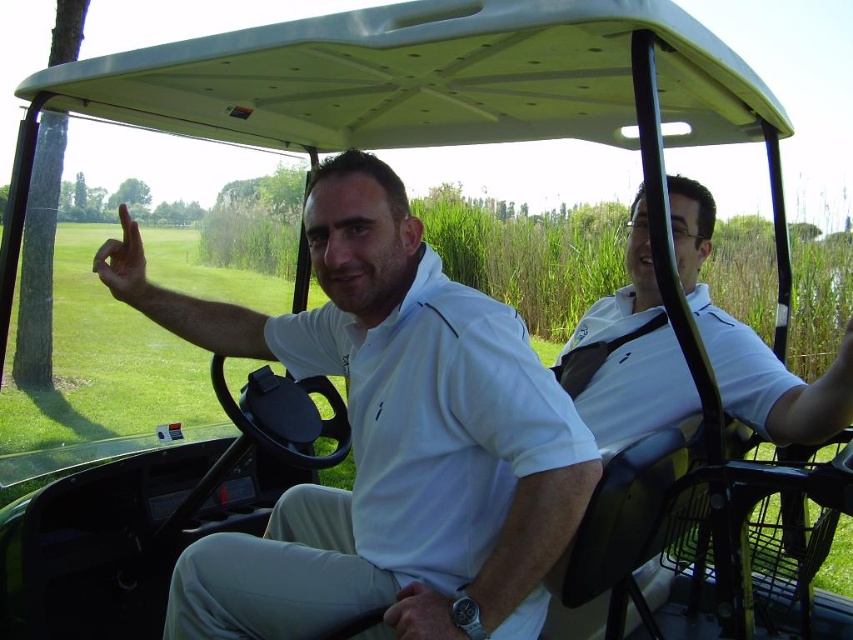
Is the position of white smooth shirt at center more distant than that of white matte shirt at center?

No.

Can you confirm if white smooth shirt at center is bigger than white matte shirt at center?

Indeed, white smooth shirt at center has a larger size compared to white matte shirt at center.

Measure the distance between white smooth shirt at center and camera.

They are 1.24 meters apart.

Identify the location of white smooth shirt at center. pyautogui.click(x=386, y=440).